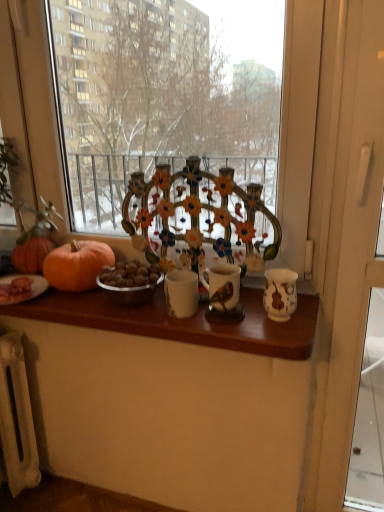
What do you see at coordinates (77, 265) in the screenshot? This screenshot has width=384, height=512. I see `orange matte pumpkin at left` at bounding box center [77, 265].

At what (x,y) coordinates should I click in order to perform the action: click on wooden table at center. Please return your answer as a coordinate pair (x, y). Looking at the image, I should click on (182, 321).

Where is `white plastic screen door at right`? This screenshot has height=512, width=384. white plastic screen door at right is located at coordinates (347, 218).

Considering the positions of objects orange matte pumpkin at left and wooden table at center in the image provided, who is in front, orange matte pumpkin at left or wooden table at center?

wooden table at center is more forward.

Is orange matte pumpkin at left oriented towards wooden table at center?

No, orange matte pumpkin at left is not aimed at wooden table at center.

Is point (79, 261) farther from viewer compared to point (240, 342)?

That is True.

In the scene shown: In terms of width, does orange matte pumpkin at left look wider or thinner when compared to wooden table at center?

In the image, orange matte pumpkin at left appears to be more narrow than wooden table at center.

From the image's perspective, which one is positioned higher, matte ceramic candle holder at center or orange matte pumpkin at left?

orange matte pumpkin at left appears higher in the image.

Is orange matte pumpkin at left a part of matte ceramic candle holder at center?

No.

From a real-world perspective, which is physically below, matte ceramic candle holder at center or orange matte pumpkin at left?

In real-world perspective, matte ceramic candle holder at center is lower.

Looking at this image, from the image's perspective, is white plastic screen door at right located above or below matte ceramic candle holder at center?

Based on their image positions, white plastic screen door at right is located beneath matte ceramic candle holder at center.

Is white plastic screen door at right directly adjacent to matte ceramic candle holder at center?

They are not placed beside each other.

Find the location of a particular element. This screenshot has width=384, height=512. screen door below the matte ceramic candle holder at center (from a real-world perspective) is located at coordinates (347, 218).

Considering the positions of point (337, 415) and point (232, 267), is point (337, 415) closer or farther from the camera than point (232, 267)?

Point (337, 415) appears to be farther away from the viewer than point (232, 267).

In terms of size, does white plastic screen door at right appear bigger or smaller than wooden table at center?

white plastic screen door at right is bigger than wooden table at center.

Are white plastic screen door at right and wooden table at center making contact?

white plastic screen door at right and wooden table at center are clearly separated.

Is white plastic screen door at right positioned with its back to wooden table at center?

That's not correct — white plastic screen door at right is not looking away from wooden table at center.

Does white plastic screen door at right have a lesser height compared to wooden table at center?

No.

From the picture: From the image's perspective, who appears lower, matte ceramic candle holder at center or white plastic screen door at right?

white plastic screen door at right, from the image's perspective.

How many degrees apart are the facing directions of matte ceramic candle holder at center and white plastic screen door at right?

0.00048 degrees.

Choose the correct answer: Is matte ceramic candle holder at center inside white plastic screen door at right or outside it?

matte ceramic candle holder at center cannot be found inside white plastic screen door at right.

Is the surface of matte ceramic candle holder at center in direct contact with white plastic screen door at right?

No, matte ceramic candle holder at center is not beside white plastic screen door at right.

Between point (313, 495) and point (90, 269), which one is positioned behind?

The point (313, 495) is more distant.

Is white plastic screen door at right located outside orange matte pumpkin at left?

Yes, white plastic screen door at right is outside of orange matte pumpkin at left.

Is white plastic screen door at right in contact with orange matte pumpkin at left?

No, white plastic screen door at right is not next to orange matte pumpkin at left.

From the picture: What's the angular difference between wooden table at center and orange matte pumpkin at left's facing directions?

They differ by 0.705 degrees in their facing directions.

From a real-world perspective, who is located lower, wooden table at center or orange matte pumpkin at left?

wooden table at center.

Does wooden table at center come in front of orange matte pumpkin at left?

Yes, wooden table at center is closer to the camera.

Find the location of a particular element. This screenshot has height=512, width=384. table located below the orange matte pumpkin at left (from the image's perspective) is located at coordinates (182, 321).

This screenshot has width=384, height=512. Find the location of `pumpkin located above the matte ceramic candle holder at center (from the image's perspective)`. pumpkin located above the matte ceramic candle holder at center (from the image's perspective) is located at coordinates (77, 265).

Looking at the image, which one is located further to orange matte pumpkin at left, matte ceramic candle holder at center or white plastic screen door at right?

Among the two, white plastic screen door at right is located further to orange matte pumpkin at left.

Which object lies nearer to the anchor point orange matte pumpkin at left, wooden table at center or matte ceramic candle holder at center?

The object closer to orange matte pumpkin at left is wooden table at center.

From the image, which object appears to be farther from matte ceramic candle holder at center, orange matte pumpkin at left or wooden table at center?

orange matte pumpkin at left lies further to matte ceramic candle holder at center than the other object.

Estimate the real-world distances between objects in this image. Which object is further from orange matte pumpkin at left, white plastic screen door at right or wooden table at center?

white plastic screen door at right.

Looking at the image, which one is located closer to wooden table at center, matte ceramic candle holder at center or orange matte pumpkin at left?

matte ceramic candle holder at center.

From the image, which object appears to be nearer to white plastic screen door at right, orange matte pumpkin at left or matte ceramic candle holder at center?

Among the two, matte ceramic candle holder at center is located nearer to white plastic screen door at right.

Considering their positions, is white plastic screen door at right positioned closer to orange matte pumpkin at left than matte ceramic candle holder at center?

matte ceramic candle holder at center lies closer to orange matte pumpkin at left than the other object.

When comparing their distances from wooden table at center, does orange matte pumpkin at left or matte ceramic candle holder at center seem closer?

Based on the image, matte ceramic candle holder at center appears to be nearer to wooden table at center.

Find the location of a particular element. table located between orange matte pumpkin at left and white plastic screen door at right in the left-right direction is located at coordinates (182, 321).

Find the location of `candle holder between wooden table at center and white plastic screen door at right`. candle holder between wooden table at center and white plastic screen door at right is located at coordinates (223, 292).

Find the location of `table between orange matte pumpkin at left and matte ceramic candle holder at center`. table between orange matte pumpkin at left and matte ceramic candle holder at center is located at coordinates (182, 321).

I want to click on candle holder between orange matte pumpkin at left and white plastic screen door at right, so click(223, 292).